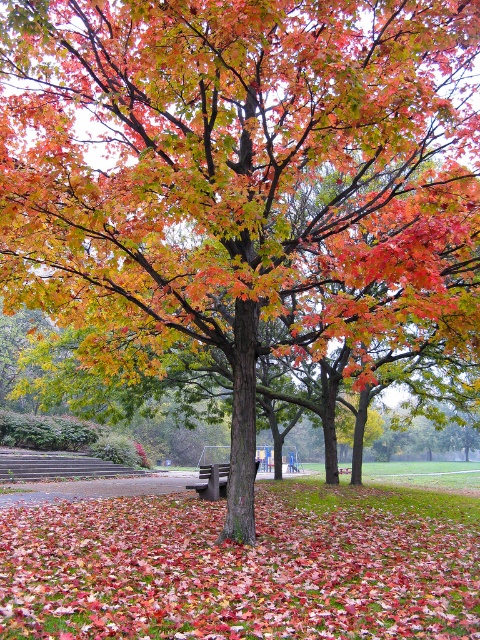
You are standing at the base of the large autumn tree in the park and notice two points marked in the image. The first point is at coordinates point (x=354, y=493) and the second is at point (x=257, y=464). If you were to walk towards both points from your current position, which point would you reach first?

Point (x=354, y=493) is in front of point (x=257, y=464), so you would reach point (x=354, y=493) first.

You are sitting on the wooden bench at center and want to place a small potted plant on the ground. Can you place it on the fallen leaves at center without it being hidden?

The fallen leaves at center have a greater height compared to the wooden bench at center. Therefore, placing the small potted plant on the fallen leaves at center may cause it to be hidden since the leaves are taller than the bench.